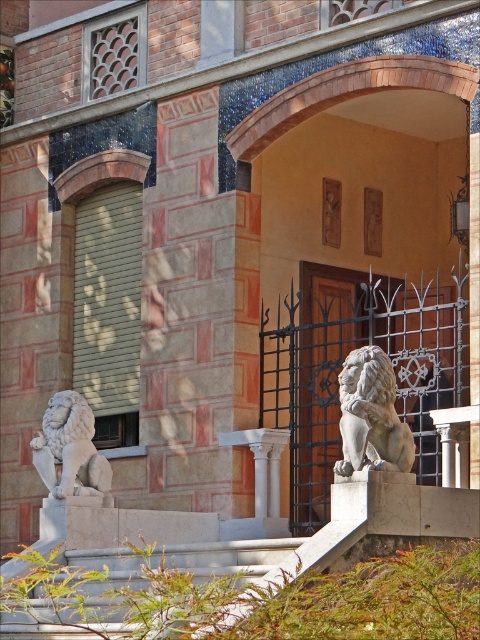
You are standing at the entrance of the building and notice a specific point marked at coordinates (371,416). Based on the image, what object is located at this point?

The point at coordinates (371,416) corresponds to the gray stone lion at center.

You are standing at the entrance of the building and want to take a photo of both the gray stone lion at center and the white marble lion at lower left. Which lion should you focus on first to ensure both are in the frame?

You should focus on the gray stone lion at center first because it is in front of the white marble lion at lower left, so adjusting the camera to include the closer lion will naturally include the one behind it.